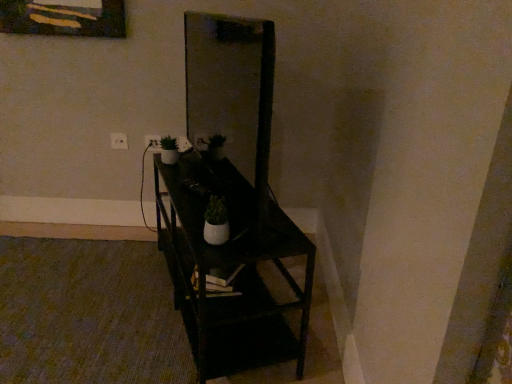
Question: From a real-world perspective, is matte glass mirror at center physically located above or below black matte shelf at center?

Choices:
 (A) below
 (B) above

Answer: (B)

Question: In terms of width, does matte glass mirror at center look wider or thinner when compared to black matte shelf at center?

Choices:
 (A) wide
 (B) thin

Answer: (B)

Question: Based on their relative distances, which object is nearer to the white plastic electric outlet at upper left, the 1th electric outlet when ordered from left to right?

Choices:
 (A) matte glass mirror at center
 (B) white plastic electric outlet at upper center, which appears as the 1th electric outlet when viewed from the right
 (C) black matte shelf at center

Answer: (B)

Question: Which object is positioned farthest from the matte glass mirror at center?

Choices:
 (A) black matte shelf at center
 (B) white plastic electric outlet at upper center, which appears as the 1th electric outlet when viewed from the right
 (C) white plastic electric outlet at upper left, the 1th electric outlet when ordered from left to right

Answer: (A)